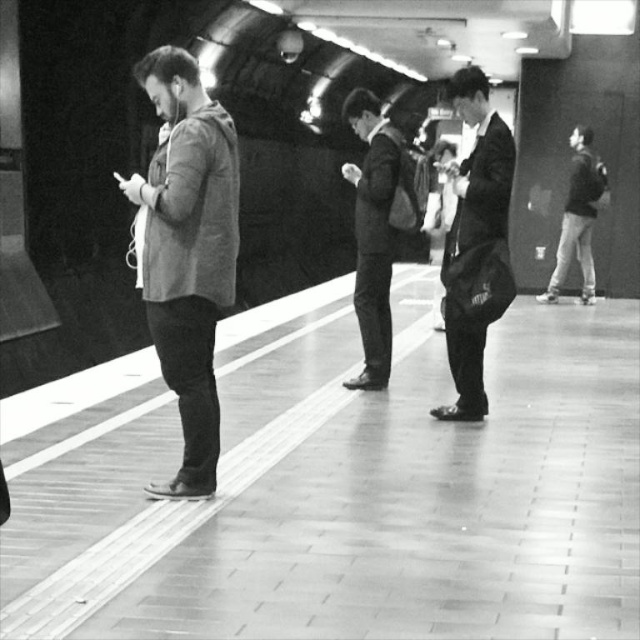
How distant is dark suit at center from dark gray backpack at right?

The distance of dark suit at center from dark gray backpack at right is 21.09 feet.

Describe the element at coordinates (376, 227) in the screenshot. I see `dark suit at center` at that location.

Who is more forward, (365,308) or (595,280)?

Point (365,308) is in front.

You are a GUI agent. You are given a task and a screenshot of the screen. Output one action in this format:
    pyautogui.click(x=<x>, y=<y>)
    Task: Click on the dark suit at center
    This screenshot has width=640, height=640.
    Given the screenshot: What is the action you would take?
    pyautogui.click(x=376, y=227)

Is point (470, 365) closer to camera compared to point (394, 157)?

Yes, point (470, 365) is in front of point (394, 157).

Between point (483, 353) and point (356, 385), which one is positioned in front?

Positioned in front is point (483, 353).

Identify the location of smooth black suit at right. The image size is (640, 640). (476, 243).

Is smooth black suit at right taller than dark gray backpack at right?

Yes, smooth black suit at right is taller than dark gray backpack at right.

Which is more to the left, smooth black suit at right or dark gray backpack at right?

From the viewer's perspective, smooth black suit at right appears more on the left side.

Which is in front, point (461, 355) or point (584, 301)?

Point (461, 355) is in front.

This screenshot has height=640, width=640. What are the coordinates of `smooth black suit at right` in the screenshot? It's located at (476, 243).